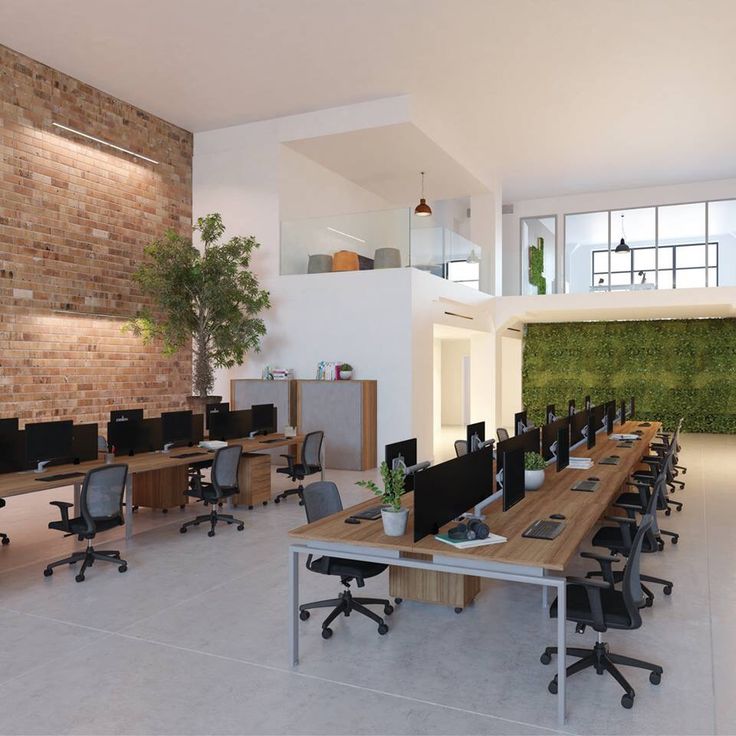
Find the location of a particular element. The height and width of the screenshot is (736, 736). keyboard is located at coordinates (539, 528), (580, 483), (609, 460), (626, 442), (372, 509), (276, 436), (197, 450), (49, 474).